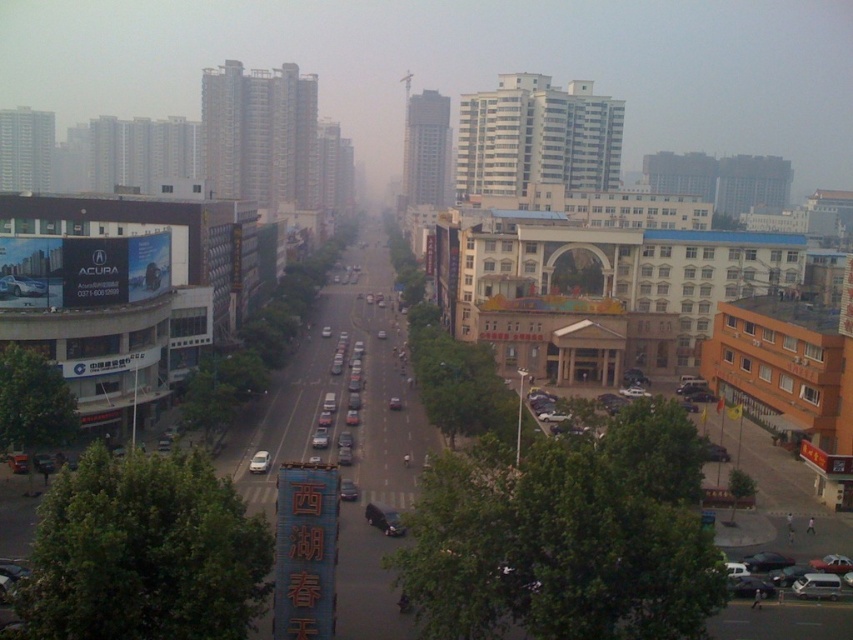
You are a delivery driver who needs to pass through the street. Your truck is 10 meters long. There is a matte black car at left and a satin silver sedan at center. Can your truck fit between them without moving either vehicle?

The distance between the matte black car at left and the satin silver sedan at center is 20.25 meters. Since your truck is 10 meters long, it can fit between them as there is enough space.

You are a pedestrian standing on the sidewalk adjacent to the wide street. You see the matte black car at left and the shiny black car at center. Which car is closer to you?

The matte black car at left is closer to you because the shiny black car at center is behind it.